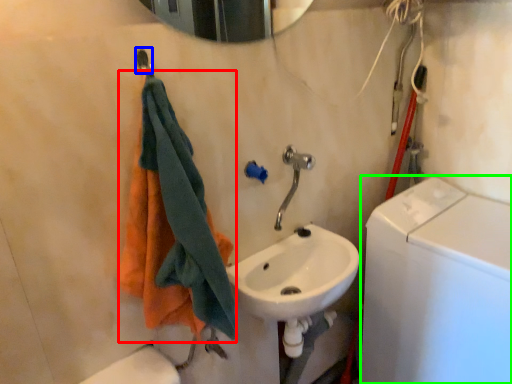
Question: Based on their relative distances, which object is farther from towel (highlighted by a red box)? Choose from shower (highlighted by a blue box) and washing machine (highlighted by a green box).

Choices:
 (A) shower
 (B) washing machine

Answer: (B)